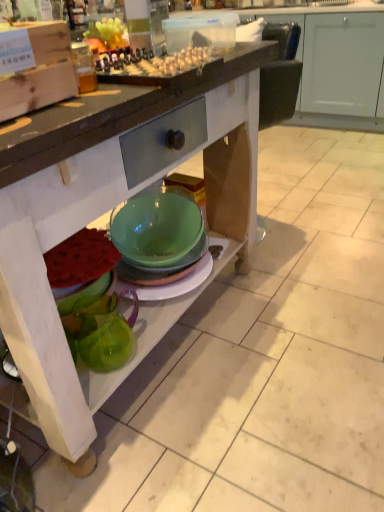
Question: Is green glass bowl at lower center completely or partially outside of matte wood cabinet at upper center?

Choices:
 (A) no
 (B) yes

Answer: (B)

Question: Does green glass bowl at lower center have a greater width compared to matte wood cabinet at upper center?

Choices:
 (A) yes
 (B) no

Answer: (A)

Question: Can you confirm if green glass bowl at lower center is positioned to the left of matte wood cabinet at upper center?

Choices:
 (A) no
 (B) yes

Answer: (B)

Question: Is green glass bowl at lower center shorter than matte wood cabinet at upper center?

Choices:
 (A) no
 (B) yes

Answer: (A)

Question: From the image's perspective, would you say green glass bowl at lower center is shown under matte wood cabinet at upper center?

Choices:
 (A) no
 (B) yes

Answer: (B)

Question: Could matte wood cabinet at upper center be considered to be inside green glass bowl at lower center?

Choices:
 (A) yes
 (B) no

Answer: (A)

Question: Does green glass pitcher at lower left appear on the right side of green glass bowl at lower center?

Choices:
 (A) no
 (B) yes

Answer: (A)

Question: Can you confirm if green glass pitcher at lower left is bigger than green glass bowl at lower center?

Choices:
 (A) no
 (B) yes

Answer: (A)

Question: Is green glass pitcher at lower left far away from green glass bowl at lower center?

Choices:
 (A) yes
 (B) no

Answer: (B)

Question: Is green glass pitcher at lower left facing away from green glass bowl at lower center?

Choices:
 (A) yes
 (B) no

Answer: (A)

Question: Considering the relative sizes of green glass pitcher at lower left and green glass bowl at lower center in the image provided, is green glass pitcher at lower left shorter than green glass bowl at lower center?

Choices:
 (A) no
 (B) yes

Answer: (B)

Question: Considering the relative sizes of green glass pitcher at lower left and green glass bowl at lower center in the image provided, is green glass pitcher at lower left thinner than green glass bowl at lower center?

Choices:
 (A) no
 (B) yes

Answer: (B)

Question: Considering the relative sizes of matte wood cabinet at upper center and translucent plastic container at upper center in the image provided, is matte wood cabinet at upper center taller than translucent plastic container at upper center?

Choices:
 (A) no
 (B) yes

Answer: (B)